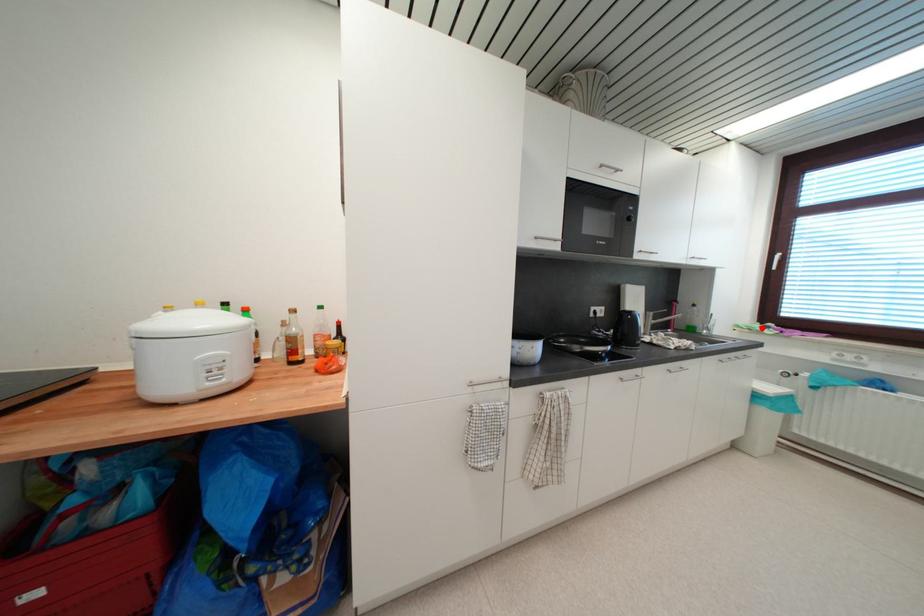
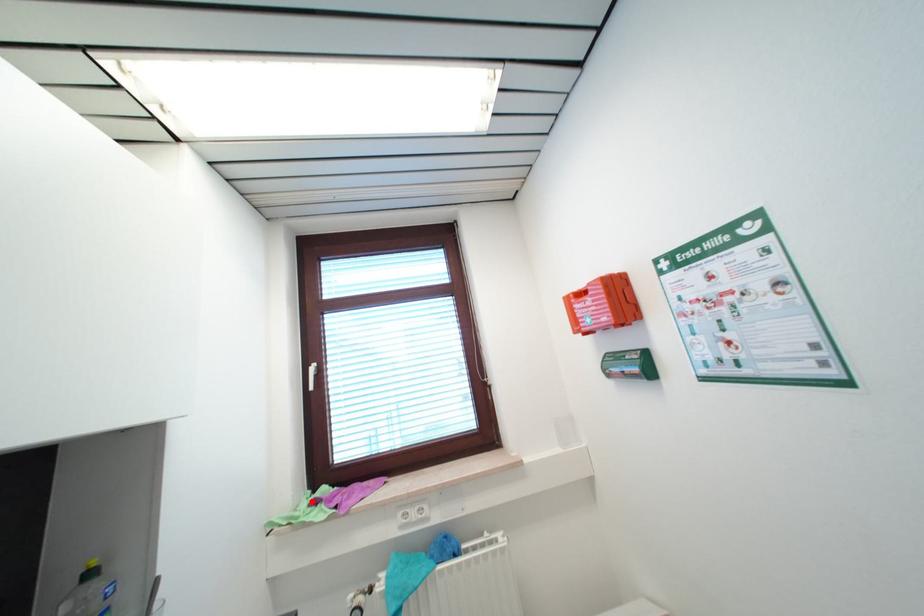
I am providing you with two images of the same scene from different viewpoints. A red point is marked on the first image and another point is marked on the second image. Do the highlighted points in image1 and image2 indicate the same real-world spot?

Yes